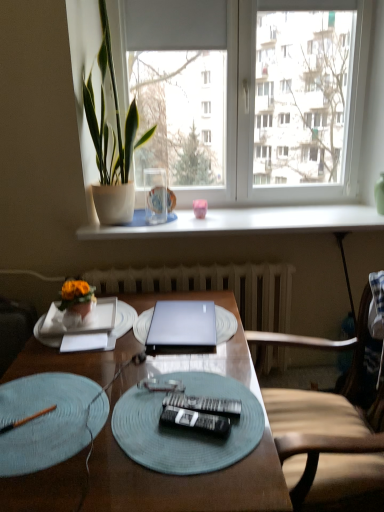
At what (x,y) coordinates should I click in order to perform the action: click on vacant area that lies to the right of light blue textured placemat at lower left. Please return your answer as a coordinate pair (x, y). The height and width of the screenshot is (512, 384). Looking at the image, I should click on (162, 416).